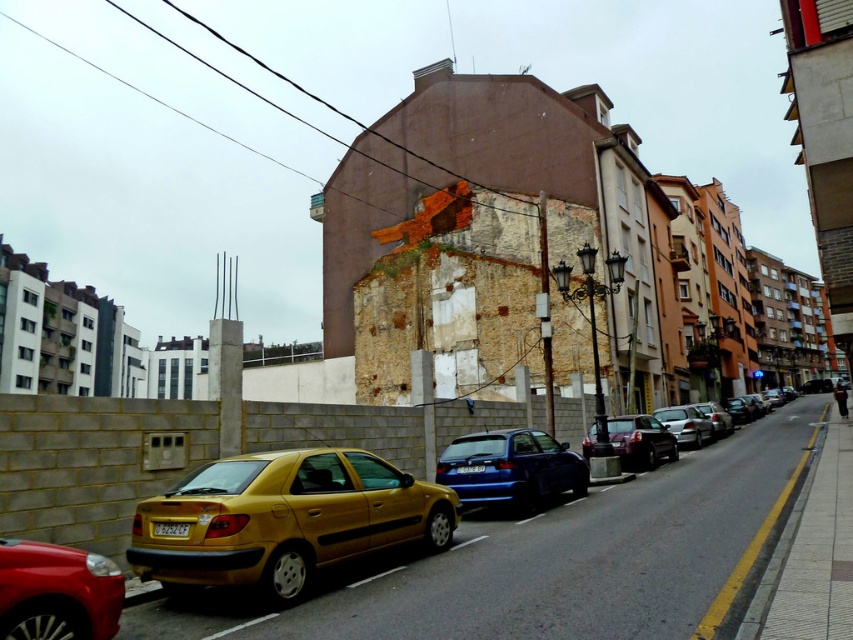
Is shiny metallic car at center taller than blue plastic license plate at center?

Indeed, shiny metallic car at center has a greater height compared to blue plastic license plate at center.

Is point (612, 433) positioned after point (457, 468)?

Yes, point (612, 433) is farther from viewer.

Locate an element on the screen. This screenshot has width=853, height=640. shiny metallic car at center is located at coordinates (640, 440).

Between metallic silver sedan at center-right and yellow matte license plate at center, which one appears on the right side from the viewer's perspective?

metallic silver sedan at center-right

Measure the distance between metallic silver sedan at center-right and yellow matte license plate at center.

They are 18.65 meters apart.

Is point (682, 416) positioned after point (173, 525)?

That is True.

Identify the location of metallic silver sedan at center-right. The width and height of the screenshot is (853, 640). (685, 424).

Can you confirm if yellow matte license plate at center is positioned below blue plastic license plate at center?

No.

Is yellow matte license plate at center further to camera compared to blue plastic license plate at center?

No.

Does point (175, 529) come farther from viewer compared to point (482, 470)?

No, it is in front of (482, 470).

At what (x,y) coordinates should I click in order to perform the action: click on yellow matte license plate at center. Please return your answer as a coordinate pair (x, y). The image size is (853, 640). Looking at the image, I should click on (171, 529).